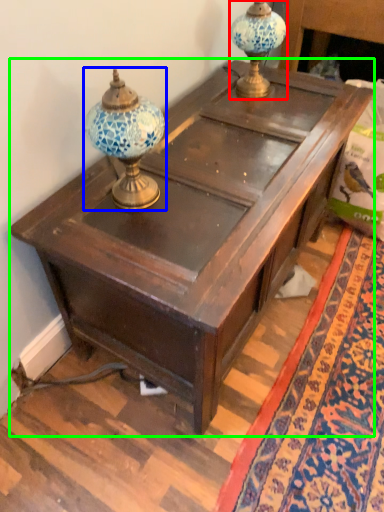
Question: Which is farther away from candle holder (highlighted by a red box)? candle holder (highlighted by a blue box) or table (highlighted by a green box)?

Choices:
 (A) candle holder
 (B) table

Answer: (A)